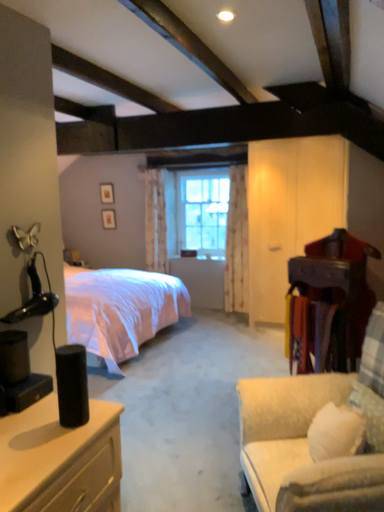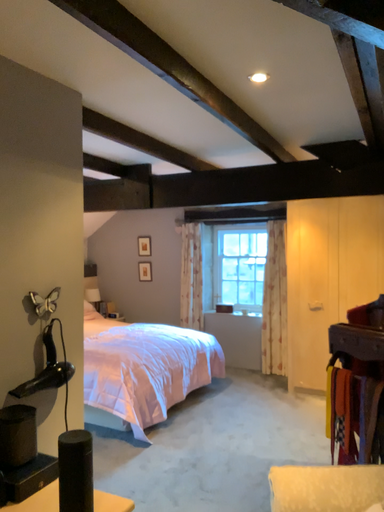
Question: Which way did the camera rotate in the video?

Choices:
 (A) rotated downward
 (B) rotated upward

Answer: (B)